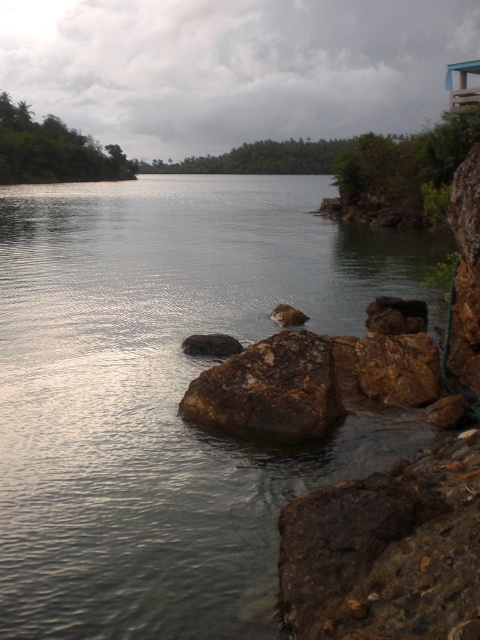
Question: Which object appears farthest from the camera in this image?

Choices:
 (A) brown rough rock at lower right
 (B) brown rough rock at center
 (C) clear water at center
 (D) rusty metallic rock at center

Answer: (B)

Question: Which of these objects is positioned farthest from the brown rough rock at lower right?

Choices:
 (A) clear water at center
 (B) brown rough rock at center
 (C) rusty rock at center

Answer: (A)

Question: Does clear water at center appear on the right side of rusty metallic rock at center?

Choices:
 (A) no
 (B) yes

Answer: (A)

Question: Does rusty rock at center come behind brown rough rock at right?

Choices:
 (A) no
 (B) yes

Answer: (A)

Question: Which point is farther to the camera?

Choices:
 (A) (269, 312)
 (B) (191, 339)
 (C) (25, 419)
 (D) (370, 324)

Answer: (A)

Question: Does rusty rock at center appear over brown rough rock at right?

Choices:
 (A) no
 (B) yes

Answer: (A)